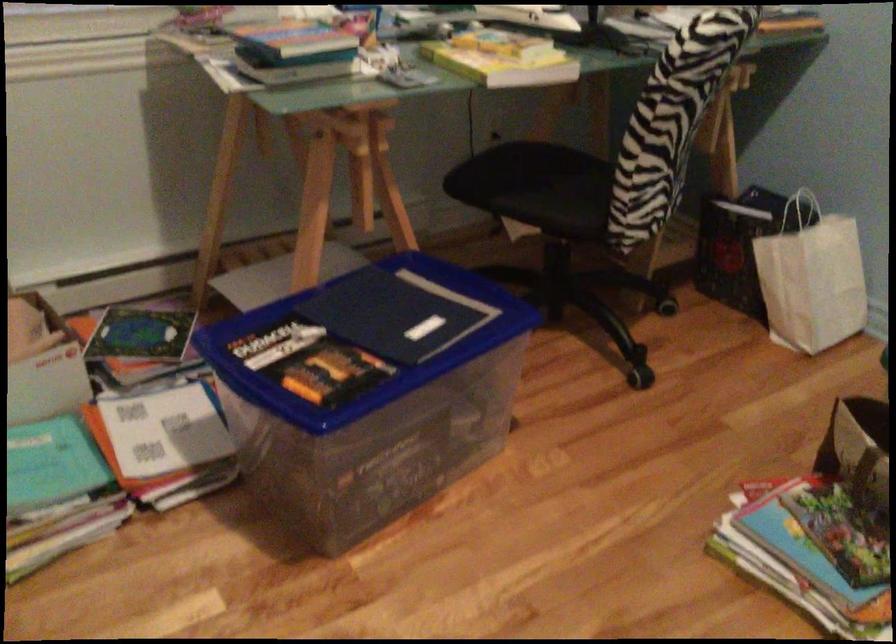
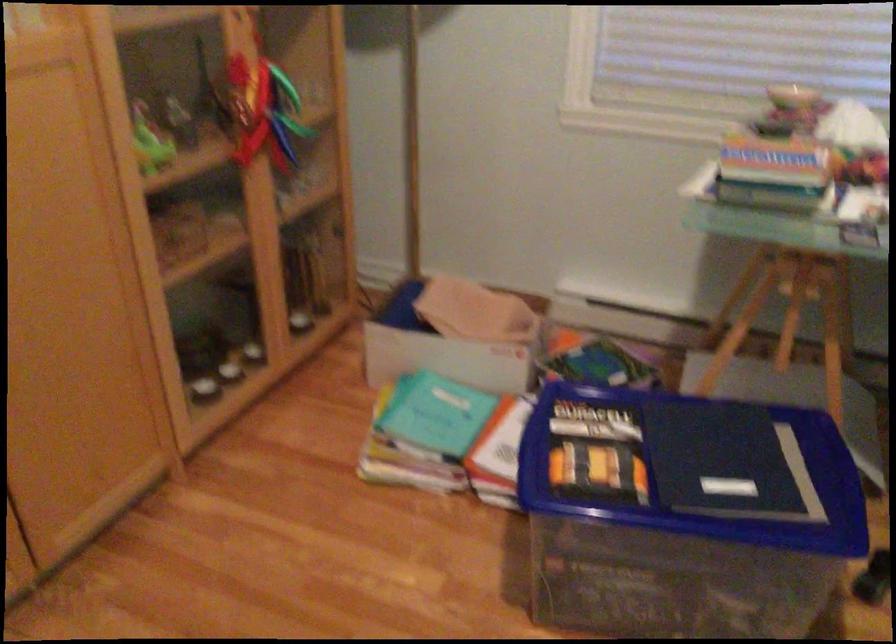
Question: The camera is either moving clockwise (left) or counter-clockwise (right) around the object. The first image is from the beginning of the video and the second image is from the end. Is the camera moving left or right when shooting the video?

Choices:
 (A) Left
 (B) Right

Answer: (B)